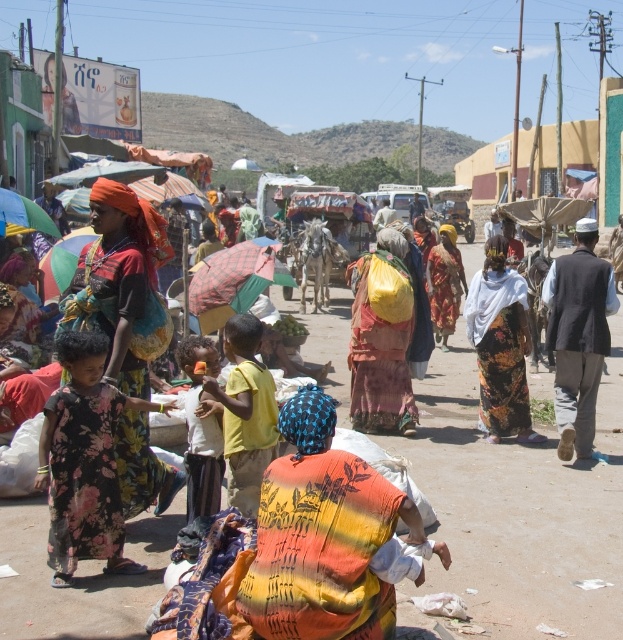
Question: Which of the following is the farthest from the observer?

Choices:
 (A) multicolored fabric bag at center
 (B) checkered fabric umbrella at center
 (C) floral fabric dress at center

Answer: (B)

Question: Does multicolored fabric bag at center have a smaller size compared to floral fabric dress at center?

Choices:
 (A) no
 (B) yes

Answer: (A)

Question: Which point is closer to the camera?

Choices:
 (A) multicolored fabric bag at center
 (B) checkered fabric umbrella at center
 (C) floral fabric dress at center
 (D) green fabric umbrella at left

Answer: (C)

Question: Can you confirm if floral fabric dress at center is positioned to the right of green fabric umbrella at left?

Choices:
 (A) no
 (B) yes

Answer: (B)

Question: Is floral fabric dress at left above checkered fabric umbrella at center?

Choices:
 (A) no
 (B) yes

Answer: (A)

Question: Among these objects, which one is farthest from the camera?

Choices:
 (A) checkered fabric umbrella at center
 (B) floral fabric dress at left
 (C) multicolored fabric bag at center
 (D) green fabric umbrella at left

Answer: (D)